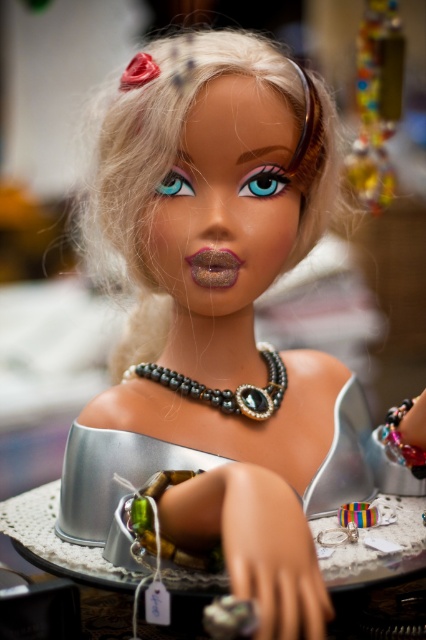
You are a customer in a jewelry store looking at the display. You see the multicolored beaded necklace at upper right and the pearl and glass beads necklace at center. Which necklace is placed higher on the display?

The multicolored beaded necklace at upper right is positioned over pearl and glass beads necklace at center, so it is placed higher on the display.

You are a customer in a jewelry store. You want to buy a necklace that is located at point (377, 102). The store has a policy that you can only purchase items that are within 0.2 units from the center of the display. Is the multicolored beaded necklace at upper right eligible for purchase?

The multicolored beaded necklace at upper right is located at point (377, 102). To determine eligibility, calculate the distance from the center of the display. The center is at point 0.5, 0.5. The distance between these points is sqrt of squared differences in x and y coordinates. Calculating sqrt of 0.339 squared plus 0.385 squared equals sqrt of 0.1149 plus 0.1482 equals sqrt of 0.2631 equals approximately 0.513 units. Since 0.513 exceeds 0.2 units, the necklace is outside the allowed range. Therefore,

Looking at this image, you are a customer in a jewelry store and want to choose between the multicolored beaded necklace at upper right and the pearl and glass beads necklace at center. Which one is larger?

The multicolored beaded necklace at upper right is bigger than the pearl and glass beads necklace at center.